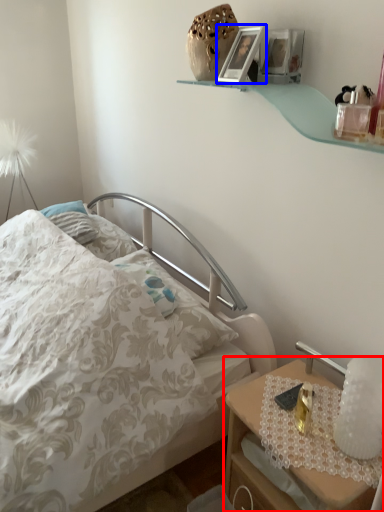
Question: Which of the following is the closest to the observer, nightstand (highlighted by a red box) or picture frame (highlighted by a blue box)?

Choices:
 (A) nightstand
 (B) picture frame

Answer: (A)